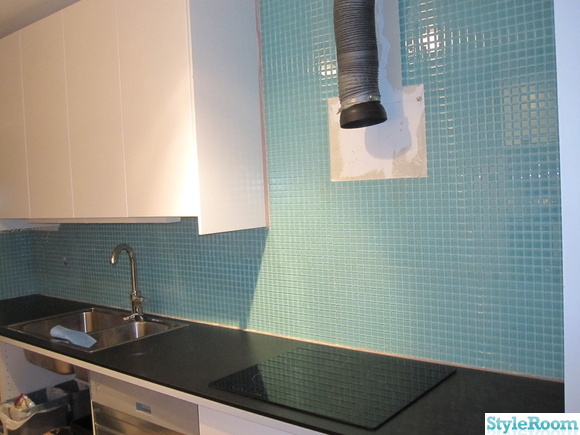
Identify the location of cabinet. (126, 42).